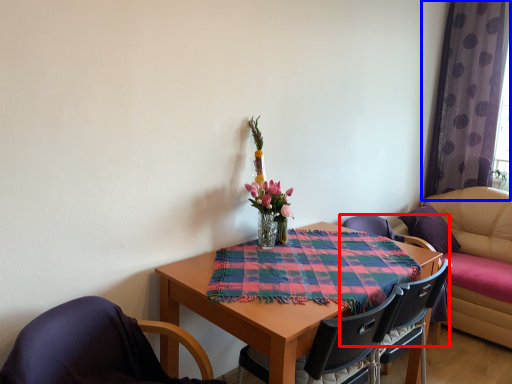
Question: Which of the following is the farthest to the observer, chair (highlighted by a red box) or curtain (highlighted by a blue box)?

Choices:
 (A) chair
 (B) curtain

Answer: (B)